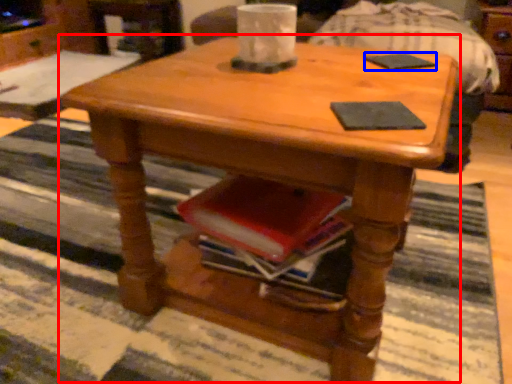
Question: Among these objects, which one is farthest to the camera, coffee table (highlighted by a red box) or pad (highlighted by a blue box)?

Choices:
 (A) coffee table
 (B) pad

Answer: (B)